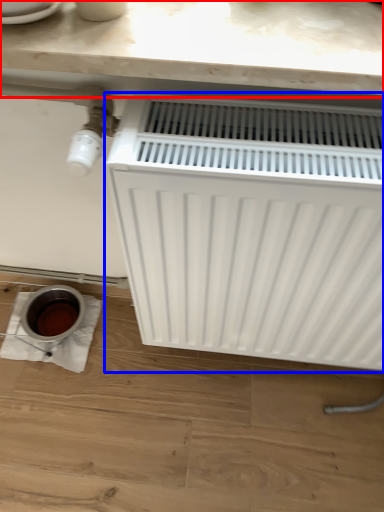
Question: Among these objects, which one is farthest to the camera, counter top (highlighted by a red box) or radiator (highlighted by a blue box)?

Choices:
 (A) counter top
 (B) radiator

Answer: (A)